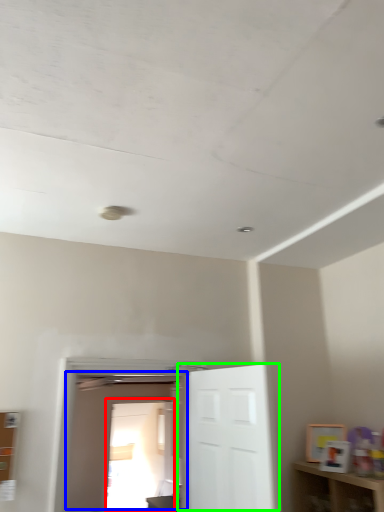
Question: Which object is positioned farthest from glass door (highlighted by a red box)? Select from door (highlighted by a blue box) and door (highlighted by a green box).

Choices:
 (A) door
 (B) door

Answer: (B)